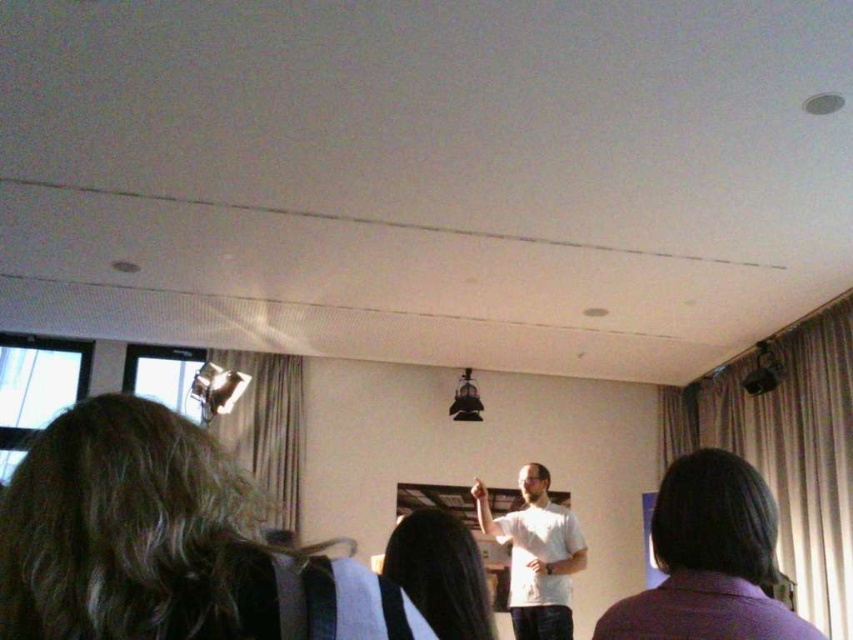
You are an attendee sitting in the back row of the room. You want to look at the presenter wearing the white matte shirt at center. Where should you look relative to the center of the room?

The white matte shirt at center is located at point 0.867 on the x axis and 0.630 on the y axis, so you should look slightly to the right and above the center of the room to see the presenter wearing the white matte shirt at center.

You are an attendee at the presentation. You want to know if the dark brown hair at lower left is narrower than the white matte shirt at center. Can you confirm this?

The dark brown hair at lower left is less in width than the white matte shirt at center, so yes, the dark brown hair at lower left is narrower than the white matte shirt at center.

You are sitting in the audience and notice two objects in the scene. One is the dark brown hair at lower left and the other is the white matte shirt at center. Which of these two objects is closer to the front of the room?

The dark brown hair at lower left is closer to the front of the room because it is shorter than the white matte shirt at center, indicating its position is nearer.